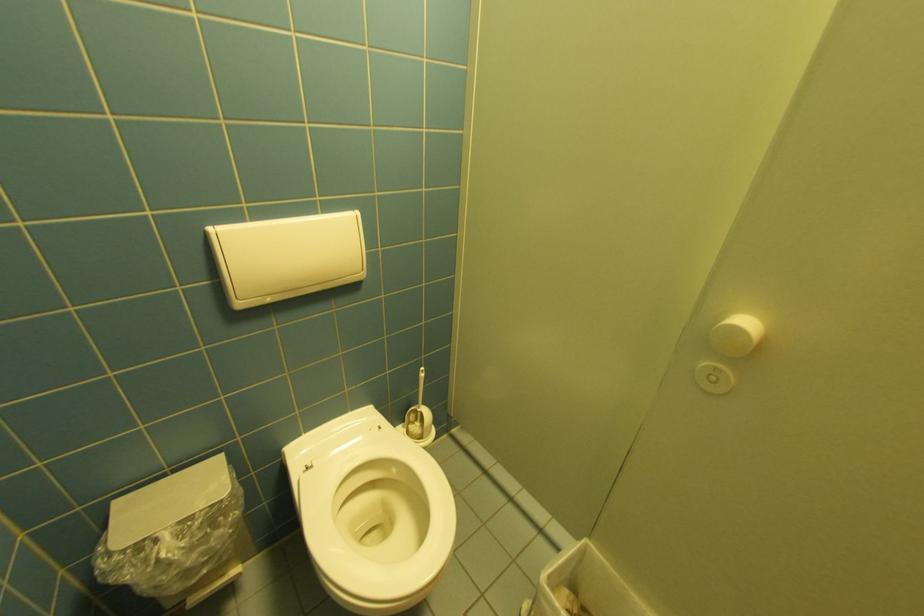
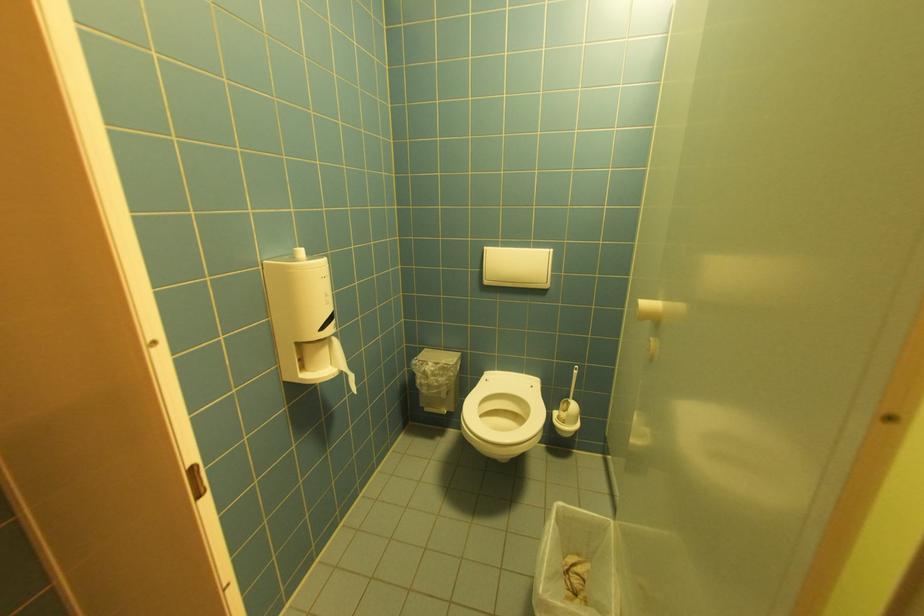
Where in the second image is the point corresponding to pixel 245 305 from the first image?

(492, 283)